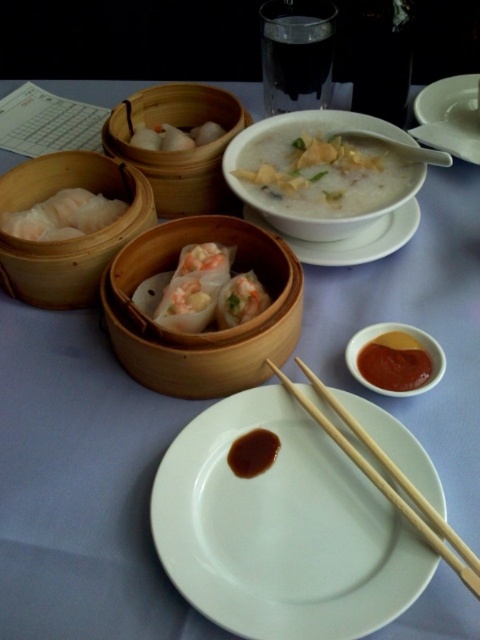
You are a customer at the restaurant and want to grab a dumpling from the wooden steamer basket at center and a spring roll from the matte bamboo steamer at upper left. Which steamer basket will you reach first?

The wooden steamer basket at center will be reached first because it is positioned in front of the matte bamboo steamer at upper left, making it closer to you.

You are a diner at the table and want to grab a dumpling from the wooden steamer basket at center and a spring roll from the matte bamboo steamer at upper left. Which steamer basket should you reach toward first if you want to minimize the distance you move your hand?

The matte bamboo steamer at upper left is closer to your current position, so you should reach toward it first to minimize the distance your hand moves.

You are a diner who wants to pour the white creamy porridge at center into the translucent bamboo steamer at center. Is there enough space between them to do this?

The white creamy porridge at center and translucent bamboo steamer at center are 5.02 inches apart, so yes, there is enough space between them to pour the porridge into the steamer.